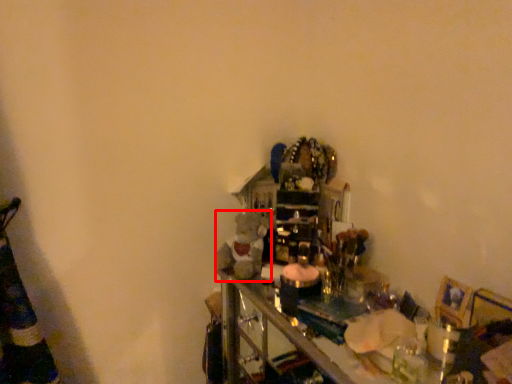
Question: Observing the image, what is the correct spatial positioning of toy (annotated by the red box) in reference to picture frame?

Choices:
 (A) left
 (B) right

Answer: (A)